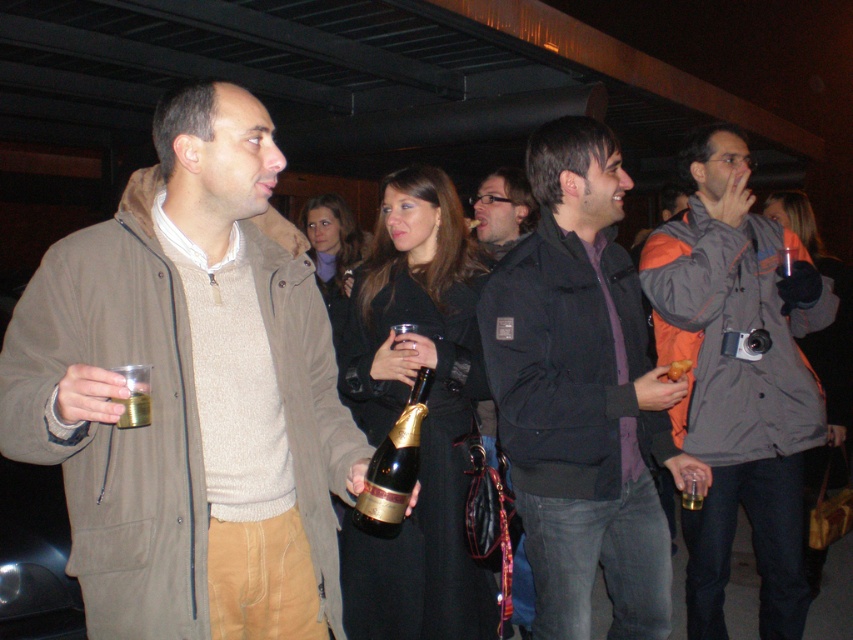
You are at a social event and see the black matte jacket at center and the gold foil champagne bottle at center. Which object is positioned higher in the image?

The black matte jacket at center is located above the gold foil champagne bottle at center, so it is positioned higher in the image.

You are a photographer trying to capture a candid shot of the gold foil champagne bottle at center without including the black matte jacket at center in the frame. Given their positions, is this possible?

The black matte jacket at center is further to the viewer than the gold foil champagne bottle at center, so the photographer can angle the camera to focus on the gold foil champagne bottle at center while avoiding the black matte jacket at center in the foreground.

You are at a social gathering and see the gold foil champagne bottle at center and the matte black jacket at center. Which object is positioned lower in the scene?

The gold foil champagne bottle at center is positioned lower than the matte black jacket at center.